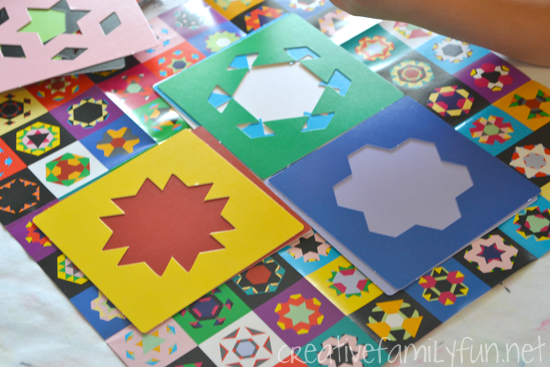
This screenshot has height=367, width=550. I want to click on counter, so click(x=53, y=332).